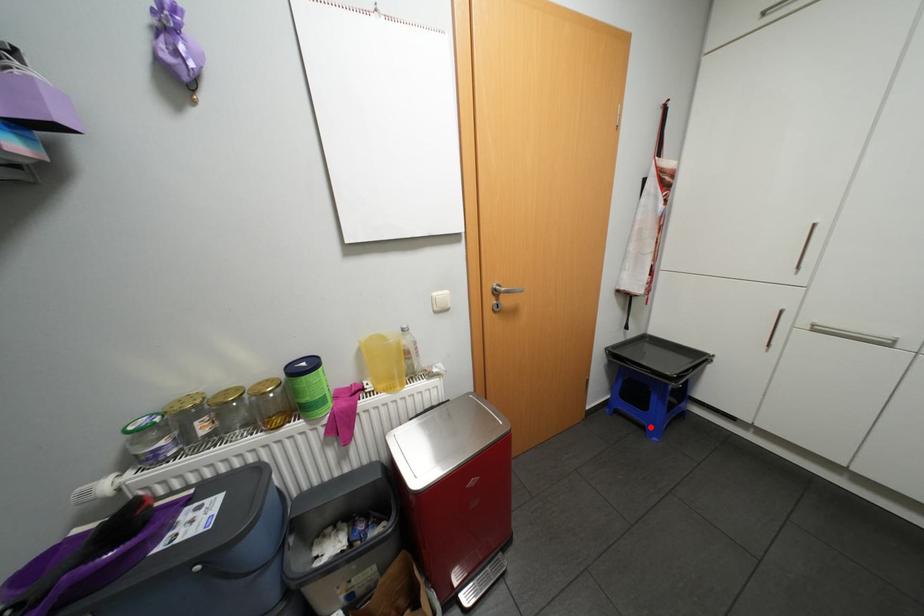
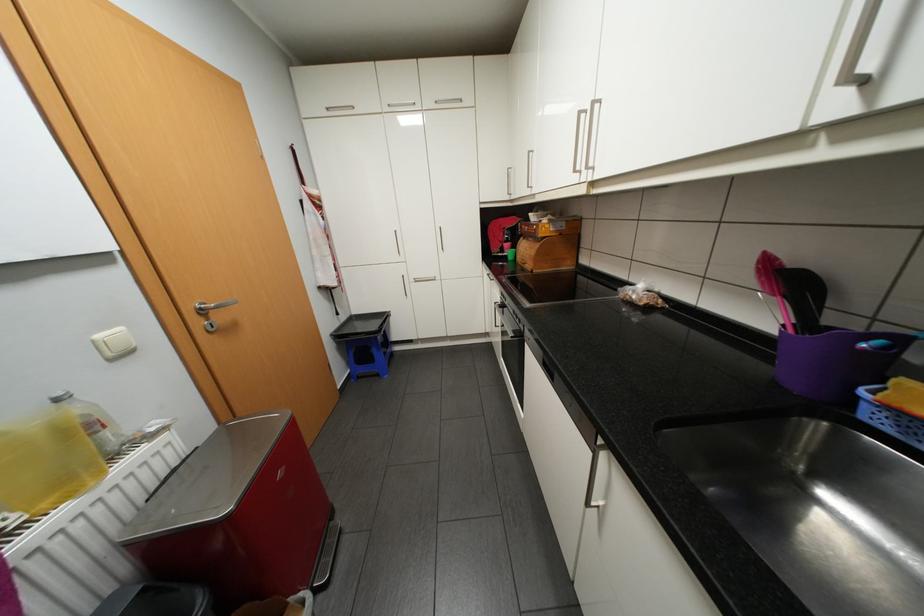
In the second image, find the point that corresponds to the highlighted location in the first image.

(385, 374)